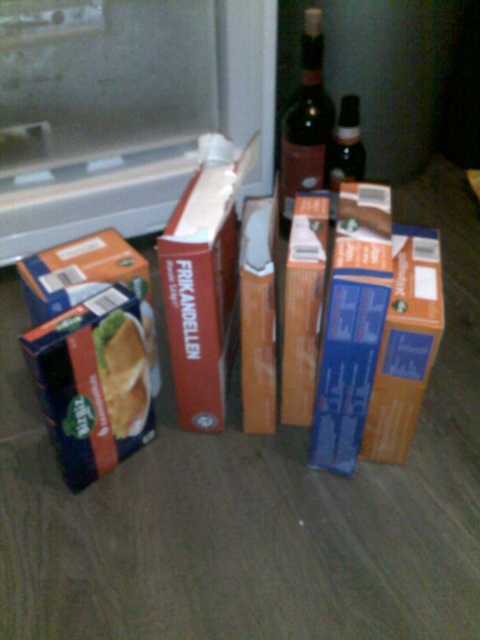
Can you confirm if blue cardboard box at lower left is taller than shiny dark glass bottle at upper center?

In fact, blue cardboard box at lower left may be shorter than shiny dark glass bottle at upper center.

Is blue cardboard box at lower left smaller than shiny dark glass bottle at upper center?

Yes.

Is point (148, 428) positioned after point (313, 116)?

No, (148, 428) is closer to viewer.

Find the location of a particular element. This screenshot has width=480, height=640. blue cardboard box at lower left is located at coordinates (93, 381).

Who is shorter, blue cardboard box at lower left or golden crisp bread at left?

Standing shorter between the two is golden crisp bread at left.

Is blue cardboard box at lower left smaller than golden crisp bread at left?

Incorrect, blue cardboard box at lower left is not smaller in size than golden crisp bread at left.

Is point (32, 342) positioned after point (148, 376)?

No, (32, 342) is in front of (148, 376).

Identify the location of blue cardboard box at lower left. (93, 381).

You are a GUI agent. You are given a task and a screenshot of the screen. Output one action in this format:
    pyautogui.click(x=<x>, y=<y>)
    Task: Click on the blue cardboard box at center
    This screenshot has height=640, width=480.
    Given the screenshot: What is the action you would take?
    pyautogui.click(x=405, y=344)

Who is positioned more to the right, blue cardboard box at center or shiny dark glass bottle at upper center?

blue cardboard box at center

Where is `blue cardboard box at center`? The image size is (480, 640). blue cardboard box at center is located at coordinates (405, 344).